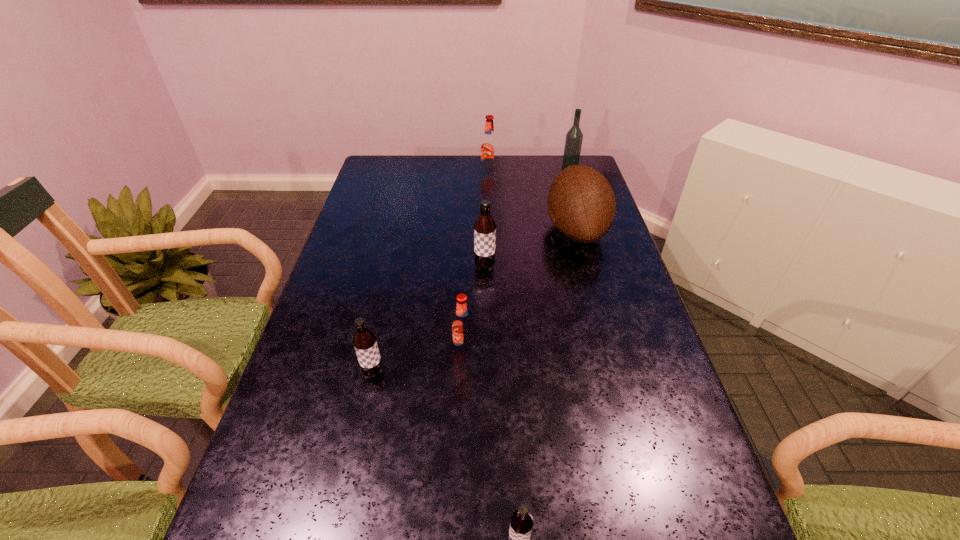
Locate an element on the screen. free location located on the left of the black vodka is located at coordinates (489, 168).

This screenshot has width=960, height=540. What are the coordinates of `free point located 0.100m on the front of the right red root beer` in the screenshot? It's located at (490, 190).

Where is `free space located 0.370m on the right of the biggest brown root beer`? This screenshot has width=960, height=540. free space located 0.370m on the right of the biggest brown root beer is located at coordinates (621, 268).

The image size is (960, 540). I want to click on free location located on the laces of the brown football, so click(509, 230).

At what (x,y) coordinates should I click in order to perform the action: click on blank space located on the laces of the brown football. Please return your answer as a coordinate pair (x, y). Image resolution: width=960 pixels, height=540 pixels. Looking at the image, I should click on (506, 230).

I want to click on blank area located on the laces of the brown football, so click(x=475, y=230).

At what (x,y) coordinates should I click in order to perform the action: click on vacant space located 0.050m on the right of the third nearest root beer. Please return your answer as a coordinate pair (x, y). The height and width of the screenshot is (540, 960). Looking at the image, I should click on (494, 350).

You are a GUI agent. You are given a task and a screenshot of the screen. Output one action in this format:
    pyautogui.click(x=<x>, y=<y>)
    Task: Click on the free location located on the right of the leftmost brown root beer
    
    Given the screenshot: What is the action you would take?
    pyautogui.click(x=527, y=374)

This screenshot has height=540, width=960. Find the location of `vodka present at the far edge`. vodka present at the far edge is located at coordinates (574, 137).

Find the location of a particular element. Image resolution: width=960 pixels, height=540 pixels. root beer at the far edge is located at coordinates (489, 144).